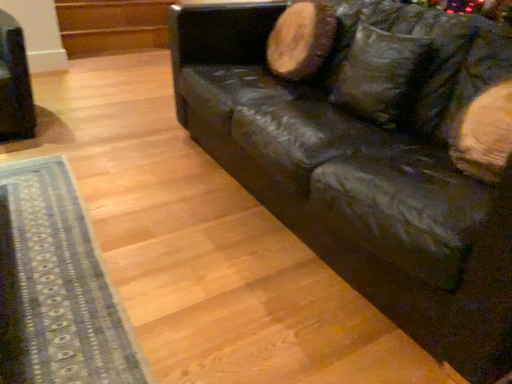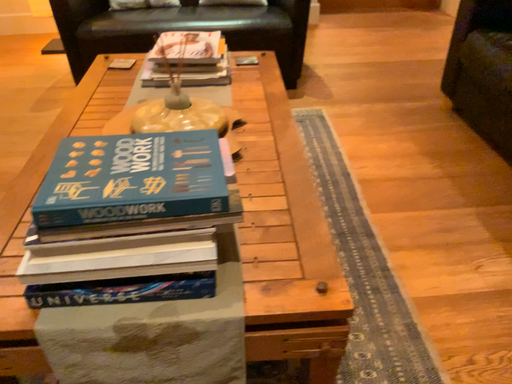
Question: How did the camera likely rotate when shooting the video?

Choices:
 (A) rotated right
 (B) rotated left

Answer: (B)